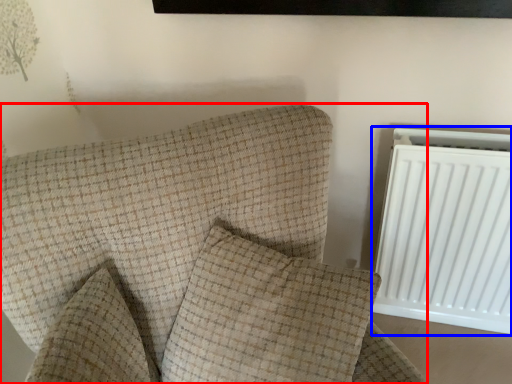
Question: Among these objects, which one is nearest to the camera, furniture (highlighted by a red box) or radiator (highlighted by a blue box)?

Choices:
 (A) furniture
 (B) radiator

Answer: (A)